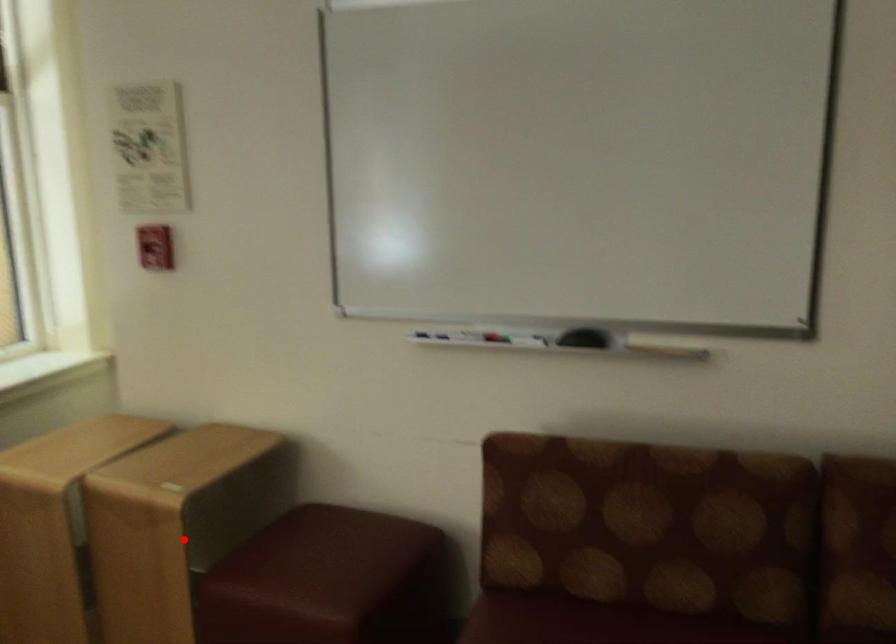
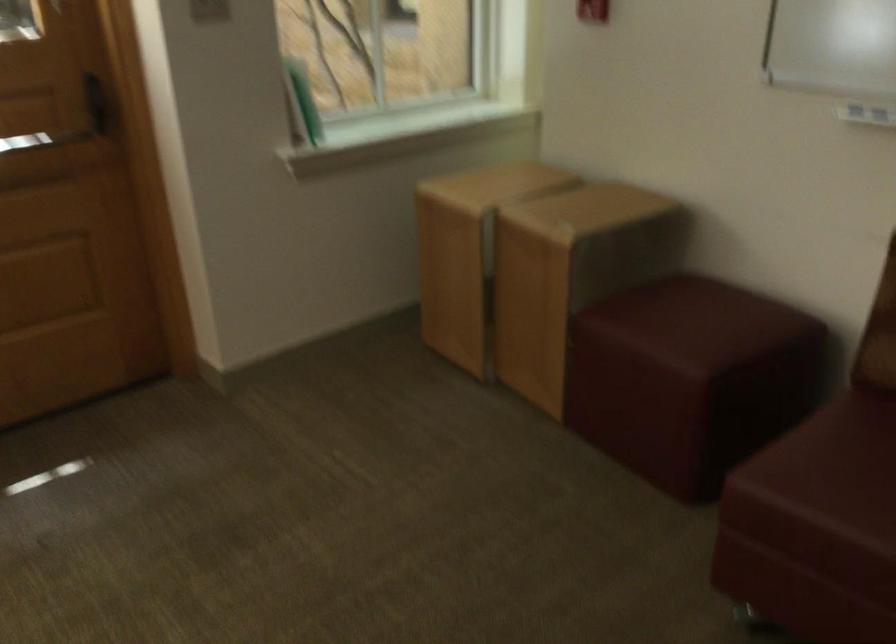
Where in the second image is the point corresponding to the highlighted location from the first image?

(570, 272)